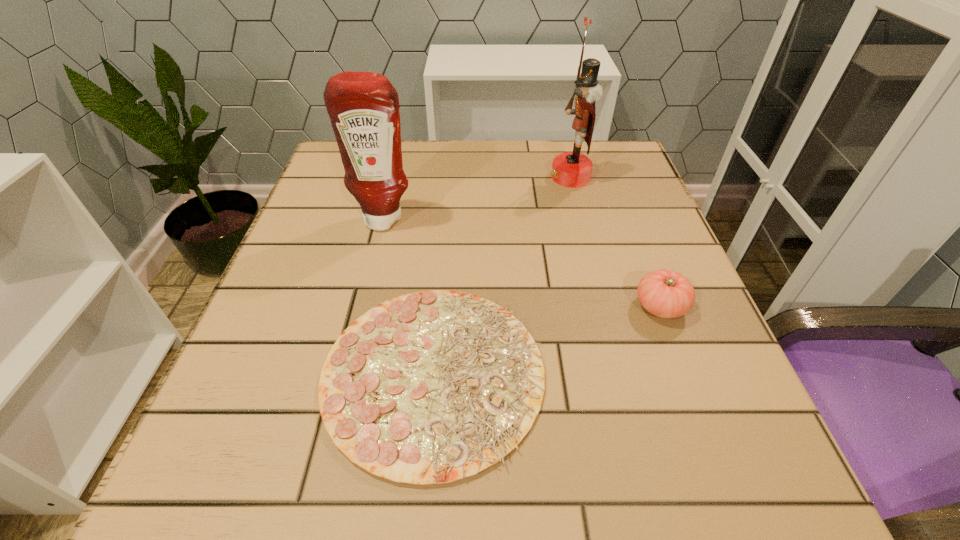
The width and height of the screenshot is (960, 540). I want to click on vacant area that lies between the tomato and the nutcracker, so click(615, 241).

Locate an element on the screen. The width and height of the screenshot is (960, 540). free point between the third nearest object and the tomato is located at coordinates (522, 263).

I want to click on object that can be found as the closest to the pizza, so click(363, 107).

Choose which object is the second nearest neighbor to the third nearest object. Please provide its 2D coordinates. Your answer should be formatted as a tuple, i.e. [(x, y)], where the tuple contains the x and y coordinates of a point satisfying the conditions above.

[(569, 169)]

The image size is (960, 540). In order to click on vacant space that satisfies the following two spatial constraints: 1. on the front side of the pizza; 2. on the right side of the condiment in this screenshot , I will do `click(346, 373)`.

You are a GUI agent. You are given a task and a screenshot of the screen. Output one action in this format:
    pyautogui.click(x=<x>, y=<y>)
    Task: Click on the vacant space that satisfies the following two spatial constraints: 1. on the back side of the rightmost object; 2. on the left side of the shortest object
    The width and height of the screenshot is (960, 540).
    Given the screenshot: What is the action you would take?
    pyautogui.click(x=440, y=306)